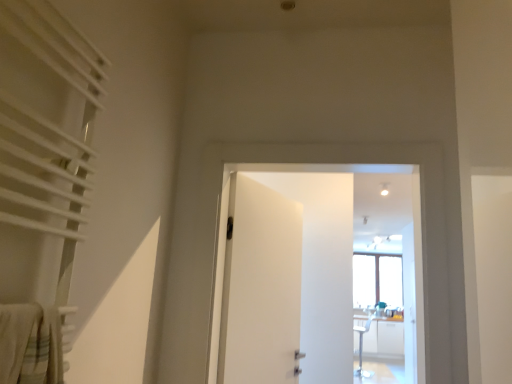
Question: Considering the positions of white matte door at center, which ranks as the 1th door in left-to-right order, and white textured curtain at left in the image, is white matte door at center, which ranks as the 1th door in left-to-right order, taller or shorter than white textured curtain at left?

Choices:
 (A) short
 (B) tall

Answer: (B)

Question: Do you think white matte door at center, positioned as the second door in right-to-left order, is within white textured curtain at left, or outside of it?

Choices:
 (A) inside
 (B) outside

Answer: (B)

Question: Estimate the real-world distances between objects in this image. Which object is farther from the white matte door at center, the 2th door from the left?

Choices:
 (A) white matte door at center, which ranks as the 1th door in left-to-right order
 (B) white textured curtain at left

Answer: (B)

Question: Which object is positioned closest to the white matte door at center, placed as the 1th door when sorted from right to left?

Choices:
 (A) white textured curtain at left
 (B) white matte door at center, positioned as the second door in right-to-left order

Answer: (B)